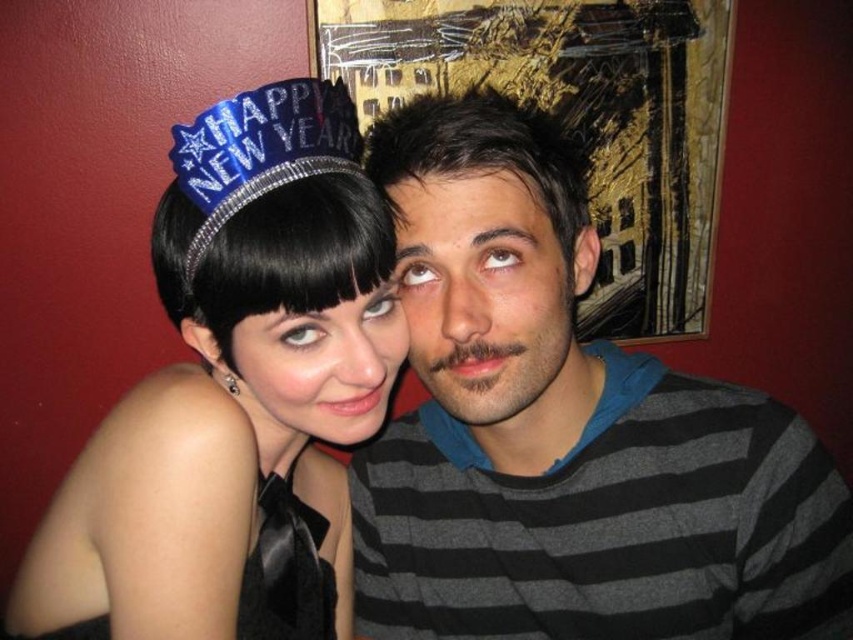
Question: Does satin black tiara at upper left have a lesser width compared to dark brown hair at center?

Choices:
 (A) yes
 (B) no

Answer: (B)

Question: Which object is the farthest from the blue sequined crown at upper left?

Choices:
 (A) gray striped sweater at center
 (B) dark brown hair at center

Answer: (A)

Question: Among these points, which one is nearest to the camera?

Choices:
 (A) (492, 257)
 (B) (357, 336)

Answer: (A)

Question: Observing the image, what is the correct spatial positioning of satin black tiara at upper left in reference to dark brown hair at center?

Choices:
 (A) right
 (B) left

Answer: (B)

Question: Can you confirm if gray striped sweater at center is thinner than dark brown hair at center?

Choices:
 (A) yes
 (B) no

Answer: (B)

Question: Which point is farther to the camera?

Choices:
 (A) (355, 324)
 (B) (297, 580)
 (C) (408, 184)

Answer: (B)